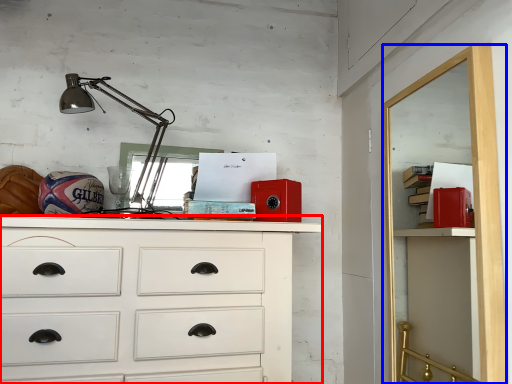
Question: Which point is further to the camera, chest of drawers (highlighted by a red box) or file cabinet (highlighted by a blue box)?

Choices:
 (A) chest of drawers
 (B) file cabinet

Answer: (A)